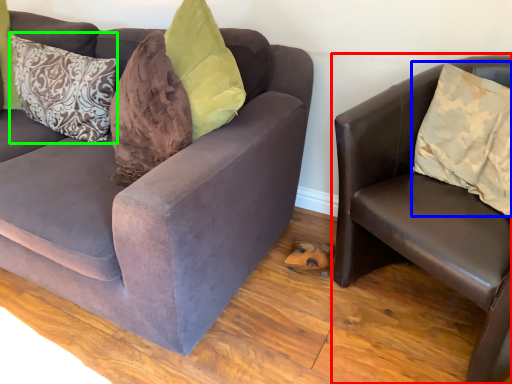
Question: Based on their relative distances, which object is farther from studio couch (highlighted by a red box)? Choose from pillow (highlighted by a blue box) and pillow (highlighted by a green box).

Choices:
 (A) pillow
 (B) pillow

Answer: (B)